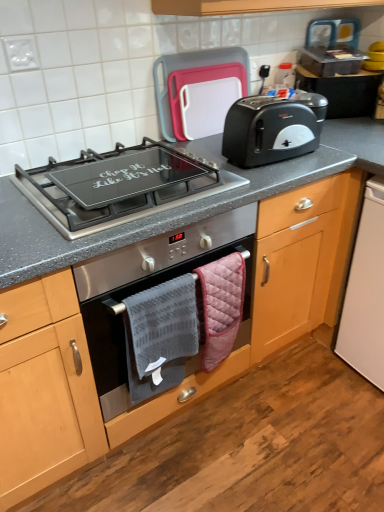
Question: Which direction should I rotate to look at gray textured towel at center, which is the 2th hand towel from right to left, — up or down?

Choices:
 (A) up
 (B) down

Answer: (B)

Question: Can you confirm if black glass cooktop at center is positioned to the left of stainless steel oven at center?

Choices:
 (A) yes
 (B) no

Answer: (A)

Question: Does black glass cooktop at center appear on the right side of stainless steel oven at center?

Choices:
 (A) no
 (B) yes

Answer: (A)

Question: Does black glass cooktop at center come behind stainless steel oven at center?

Choices:
 (A) no
 (B) yes

Answer: (A)

Question: Is black glass cooktop at center closer to camera compared to stainless steel oven at center?

Choices:
 (A) yes
 (B) no

Answer: (A)

Question: Is black glass cooktop at center facing towards stainless steel oven at center?

Choices:
 (A) yes
 (B) no

Answer: (B)

Question: Does black glass cooktop at center have a greater height compared to stainless steel oven at center?

Choices:
 (A) no
 (B) yes

Answer: (A)

Question: Is white plastic dishwasher at lower right, which is counted as the 2th appliance, starting from the top, further to camera compared to metallic silver toaster at upper right, which ranks as the second appliance in bottom-to-top order?

Choices:
 (A) yes
 (B) no

Answer: (B)

Question: Considering the relative sizes of white plastic dishwasher at lower right, marked as the first appliance in a bottom-to-top arrangement, and metallic silver toaster at upper right, the 1th appliance in the top-to-bottom sequence, in the image provided, is white plastic dishwasher at lower right, marked as the first appliance in a bottom-to-top arrangement, taller than metallic silver toaster at upper right, the 1th appliance in the top-to-bottom sequence,?

Choices:
 (A) yes
 (B) no

Answer: (A)

Question: Is white plastic dishwasher at lower right, marked as the first appliance in a bottom-to-top arrangement, positioned beyond the bounds of metallic silver toaster at upper right, which ranks as the second appliance in bottom-to-top order?

Choices:
 (A) no
 (B) yes

Answer: (B)

Question: Is white plastic dishwasher at lower right, which is counted as the 2th appliance, starting from the top, to the left of metallic silver toaster at upper right, which ranks as the second appliance in bottom-to-top order, from the viewer's perspective?

Choices:
 (A) yes
 (B) no

Answer: (B)

Question: Is white plastic dishwasher at lower right, marked as the first appliance in a bottom-to-top arrangement, aimed at metallic silver toaster at upper right, the 1th appliance in the top-to-bottom sequence?

Choices:
 (A) no
 (B) yes

Answer: (A)

Question: Considering the relative sizes of white plastic dishwasher at lower right, marked as the first appliance in a bottom-to-top arrangement, and metallic silver toaster at upper right, the 1th appliance in the top-to-bottom sequence, in the image provided, is white plastic dishwasher at lower right, marked as the first appliance in a bottom-to-top arrangement, thinner than metallic silver toaster at upper right, the 1th appliance in the top-to-bottom sequence,?

Choices:
 (A) no
 (B) yes

Answer: (A)

Question: Could you tell me if gray textured towel at center, which is the 2th hand towel from right to left, is facing plastic cutting board at upper center?

Choices:
 (A) no
 (B) yes

Answer: (A)